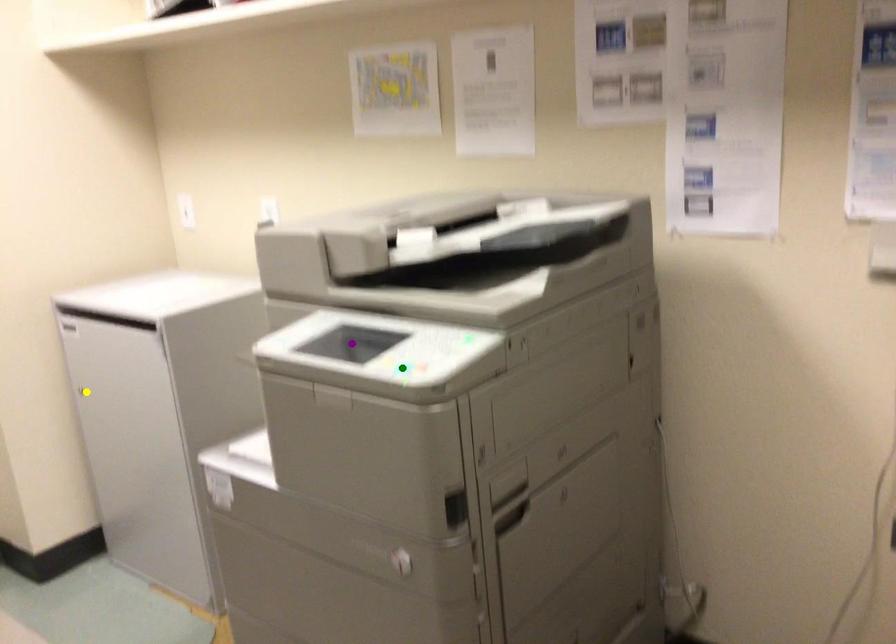
Order these from nearest to farthest:
purple point, green point, yellow point

yellow point → purple point → green point